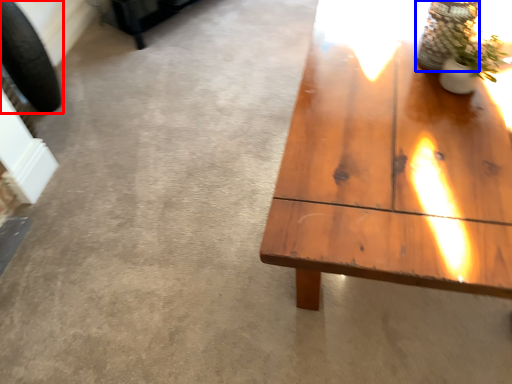
Question: Among these objects, which one is farthest to the camera, car tire (highlighted by a red box) or glass vase (highlighted by a blue box)?

Choices:
 (A) car tire
 (B) glass vase

Answer: (A)